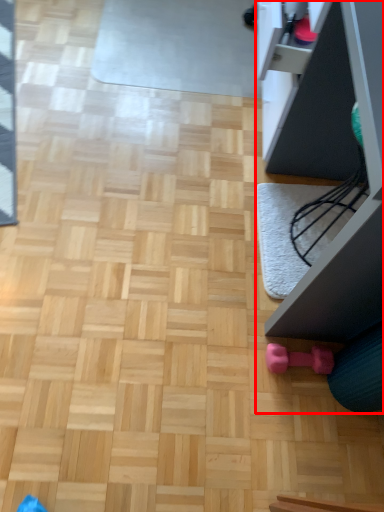
Question: Observing the image, what is the correct spatial positioning of furniture (annotated by the red box) in reference to toy?

Choices:
 (A) left
 (B) right

Answer: (B)